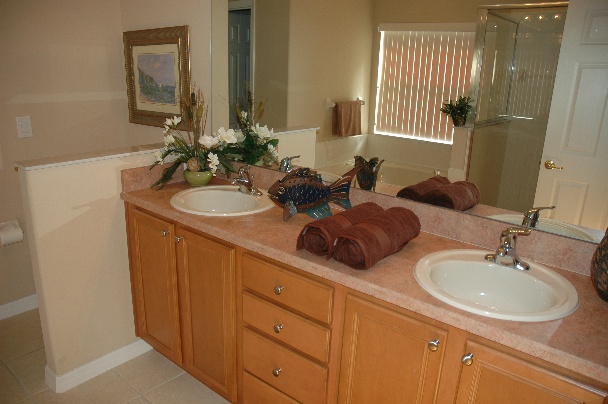
Locate an element on the screen. shower is located at coordinates (516, 160).